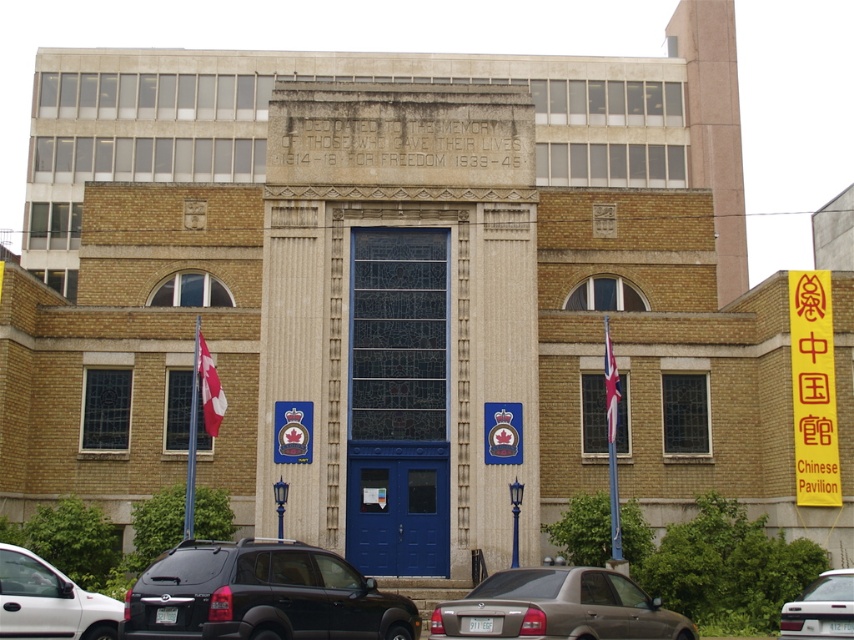
Question: Is gold metallic sedan at center thinner than red fabric flag at center?

Choices:
 (A) yes
 (B) no

Answer: (B)

Question: Which of these objects is positioned closest to the red fabric flag at center?

Choices:
 (A) metallic silver sedan at lower right
 (B) red fabric flag at left

Answer: (A)

Question: Which object is closer to the camera taking this photo?

Choices:
 (A) red fabric flag at left
 (B) red fabric flag at center
 (C) metallic silver sedan at lower right

Answer: (C)

Question: In this image, where is black matte suv at center located relative to red fabric flag at left?

Choices:
 (A) left
 (B) right

Answer: (B)

Question: Which object is positioned farthest from the gold metallic sedan at center?

Choices:
 (A) red fabric flag at left
 (B) white matte car at lower left
 (C) red fabric flag at center
 (D) black matte suv at center

Answer: (A)

Question: Is white matte car at lower left above red fabric flag at center?

Choices:
 (A) no
 (B) yes

Answer: (A)